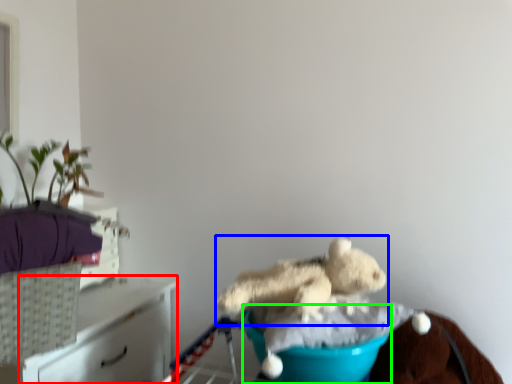
Question: Estimate the real-world distances between objects in this image. Which object is closer to furniture (highlighted by a red box), teddy bear (highlighted by a blue box) or teal (highlighted by a green box)?

Choices:
 (A) teddy bear
 (B) teal

Answer: (A)